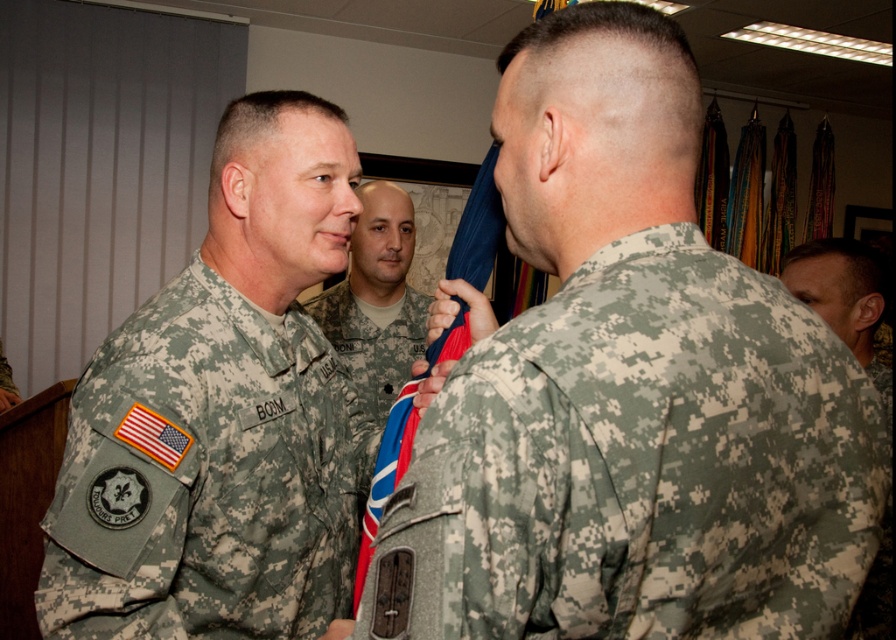
Question: Which of the following is the closest to the observer?

Choices:
 (A) digital camouflage uniform at back
 (B) camouflage uniform at center
 (C) camouflage fabric uniform at left

Answer: (A)

Question: Which point is closer to the camera?

Choices:
 (A) (196, 346)
 (B) (800, 252)

Answer: (A)

Question: Is digital camouflage uniform at back bigger than camouflage uniform at right?

Choices:
 (A) no
 (B) yes

Answer: (B)

Question: Is digital camouflage uniform at back to the right of camouflage fabric uniform at left from the viewer's perspective?

Choices:
 (A) no
 (B) yes

Answer: (B)

Question: Which object is the closest to the camouflage uniform at center?

Choices:
 (A) camouflage fabric uniform at left
 (B) digital camouflage uniform at back
 (C) camouflage uniform at right

Answer: (A)

Question: Can you confirm if digital camouflage uniform at back is smaller than camouflage fabric uniform at left?

Choices:
 (A) yes
 (B) no

Answer: (B)